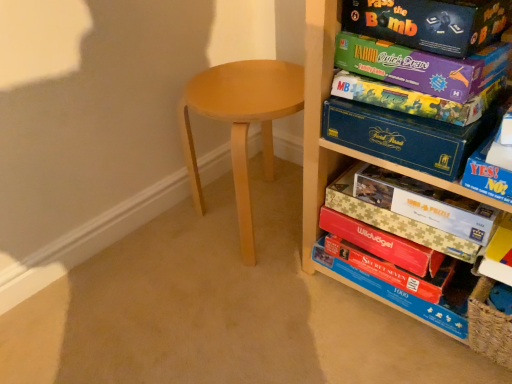
Where is `free space to the left of blue cardboard puzzle at lower right`? free space to the left of blue cardboard puzzle at lower right is located at coordinates (298, 312).